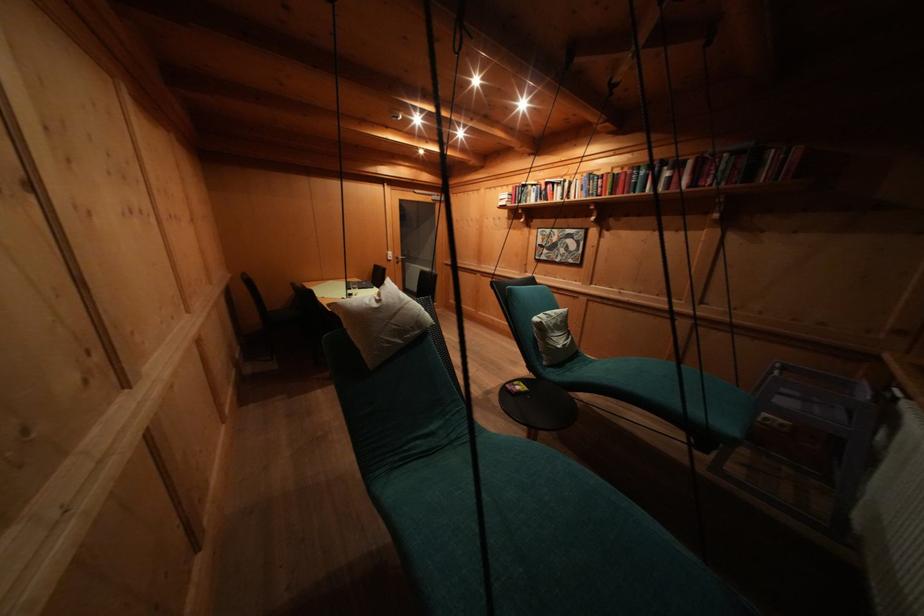
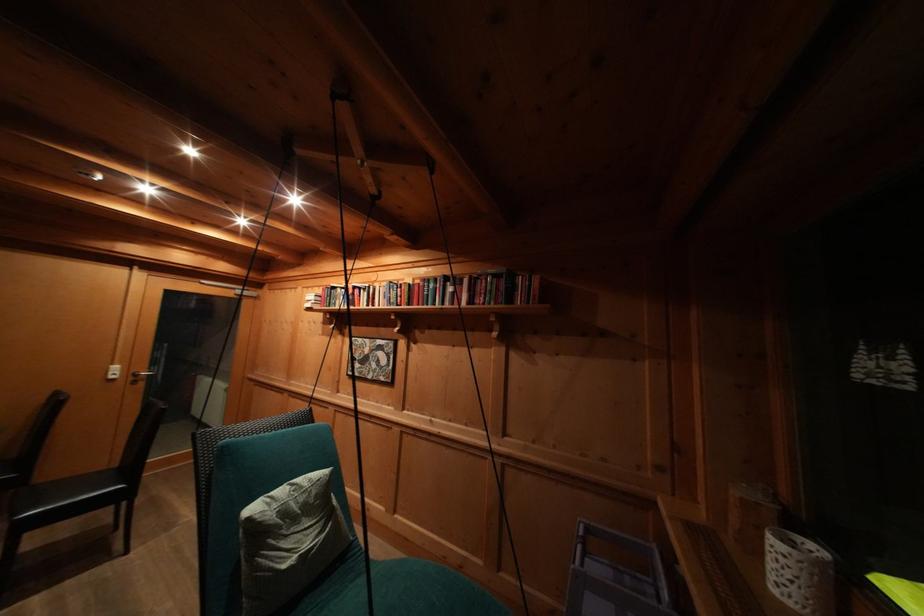
In the second image, find the point that corresponds to (x=649, y=177) in the first image.

(438, 291)